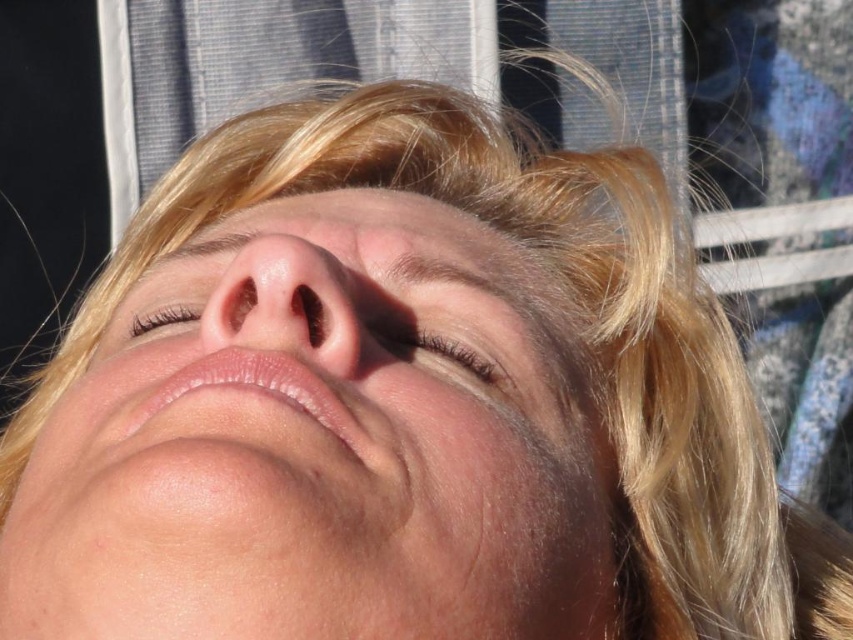
Question: Does smooth skin face at center appear over brown matte eyelid at center?

Choices:
 (A) no
 (B) yes

Answer: (A)

Question: Which point appears farthest from the camera in this image?

Choices:
 (A) (450, 349)
 (B) (369, 385)
 (C) (157, 307)

Answer: (C)

Question: Among these objects, which one is nearest to the camera?

Choices:
 (A) brown textured eyelashes at center
 (B) smooth skin face at center

Answer: (B)

Question: Which point is farther to the camera?

Choices:
 (A) (473, 368)
 (B) (537, 356)
 (C) (316, 365)

Answer: (B)

Question: Is smooth skin face at center to the right of brown matte eyelid at center from the viewer's perspective?

Choices:
 (A) no
 (B) yes

Answer: (A)

Question: Can you confirm if brown matte eyelid at center is positioned below brown textured eyelashes at center?

Choices:
 (A) yes
 (B) no

Answer: (A)